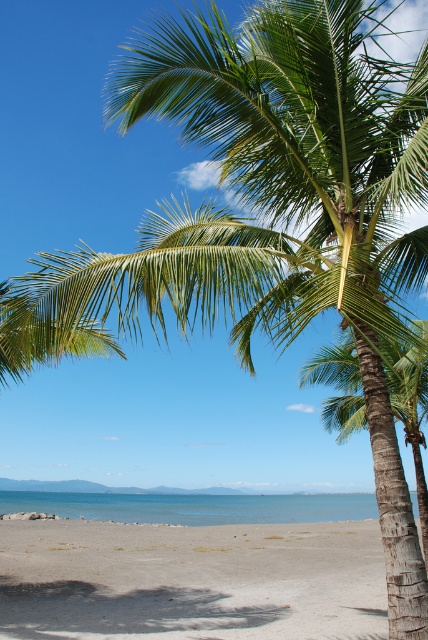
Question: Which object appears closest to the camera in this image?

Choices:
 (A) light brown sandy beach at lower center
 (B) blue water at lower center

Answer: (A)

Question: Which of the following is the farthest from the observer?

Choices:
 (A) light brown sandy beach at lower center
 (B) blue water at lower center

Answer: (B)

Question: Is light brown sandy beach at lower center positioned at the back of blue water at lower center?

Choices:
 (A) yes
 (B) no

Answer: (B)

Question: Observing the image, what is the correct spatial positioning of light brown sandy beach at lower center in reference to blue water at lower center?

Choices:
 (A) below
 (B) above

Answer: (B)

Question: Does light brown sandy beach at lower center appear under blue water at lower center?

Choices:
 (A) yes
 (B) no

Answer: (B)